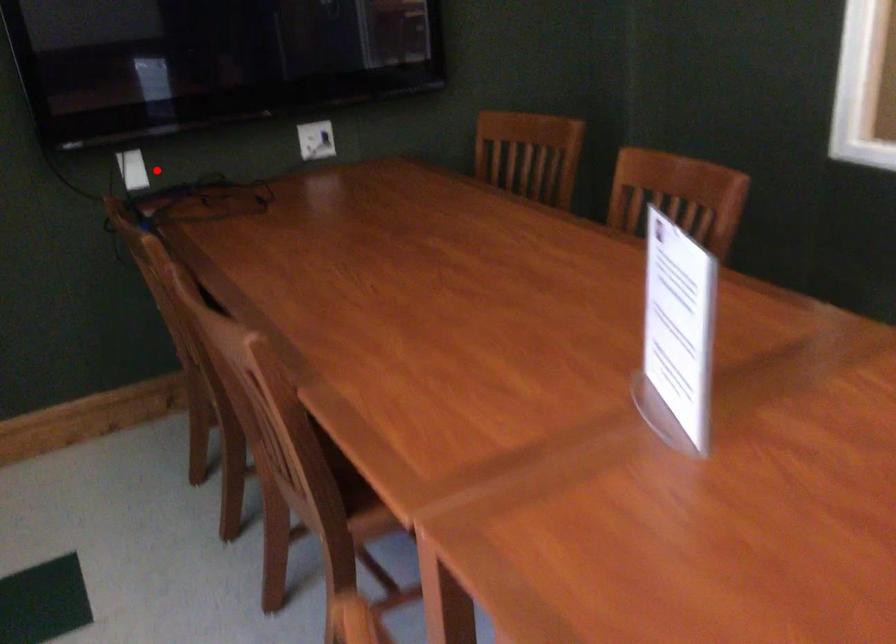
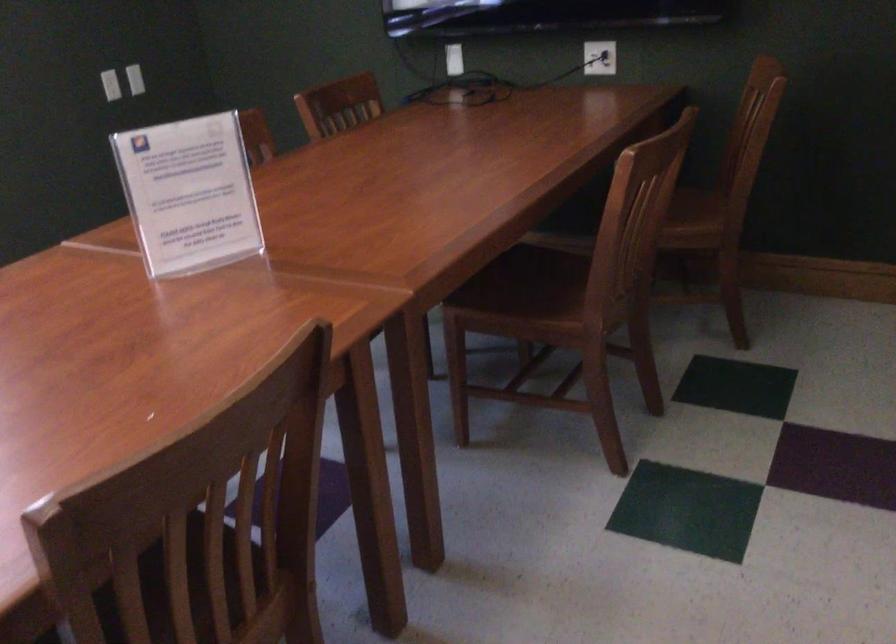
The point at the highlighted location is marked in the first image. Where is the corresponding point in the second image?

(453, 59)